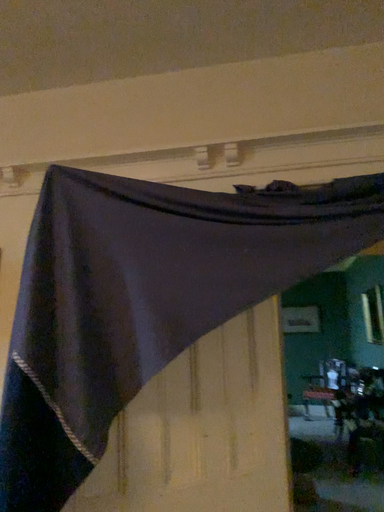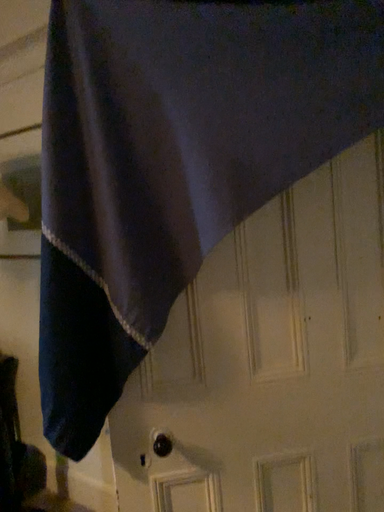
Question: Which way did the camera rotate in the video?

Choices:
 (A) rotated downward
 (B) rotated upward

Answer: (A)